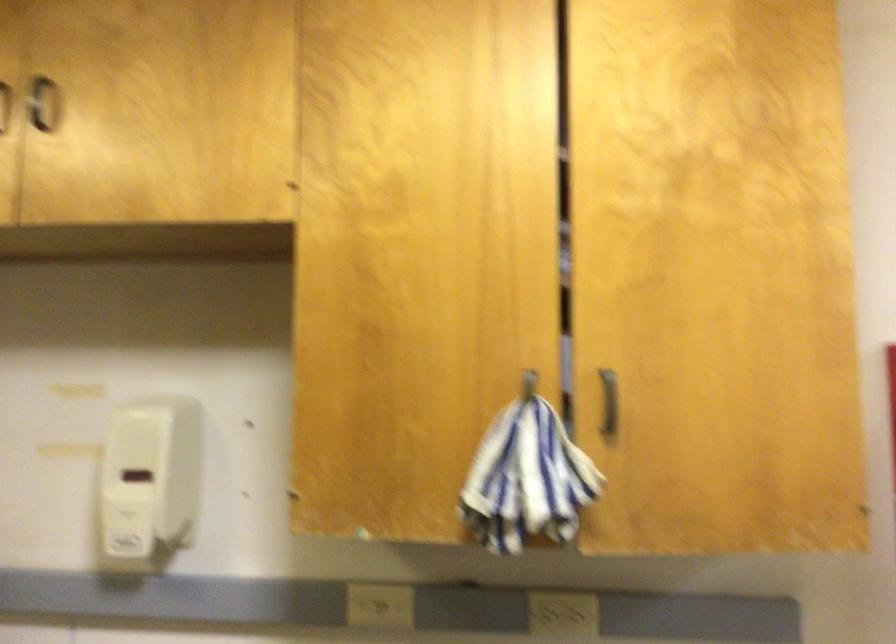
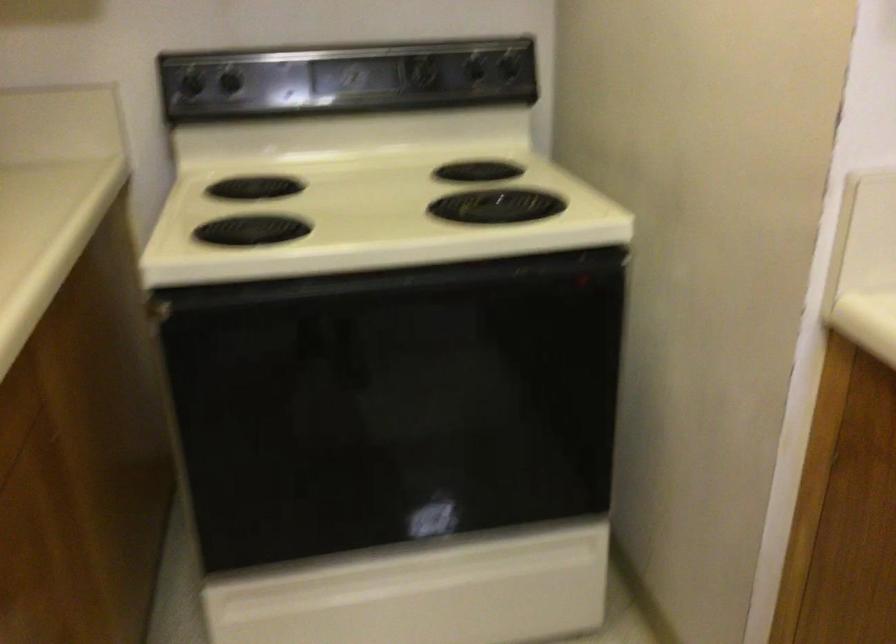
How did the camera likely rotate?

The camera rotated toward left-down.